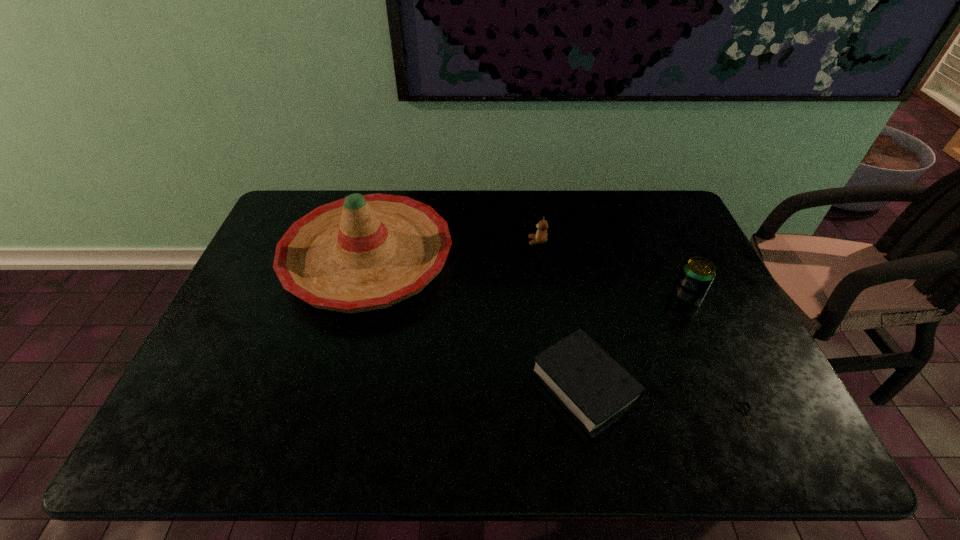
Where is `vacant space in between the Bible and the sombrero`? This screenshot has height=540, width=960. vacant space in between the Bible and the sombrero is located at coordinates (476, 322).

Identify the location of vacant space in between the leftmost object and the shortest object. (559, 340).

Identify the location of empty space that is in between the teddy bear and the shears. (643, 331).

The width and height of the screenshot is (960, 540). I want to click on free space between the third tallest object and the tallest object, so click(x=453, y=250).

The height and width of the screenshot is (540, 960). I want to click on free point between the shears and the fourth tallest object, so click(667, 403).

The image size is (960, 540). I want to click on vacant area that lies between the Bible and the fourth shortest object, so click(636, 342).

Identify the location of free space between the second tallest object and the sombrero. (527, 279).

Identify the location of vacant region between the shears and the teddy bear. This screenshot has height=540, width=960. (643, 331).

Point out which object is positioned as the fourth nearest to the third tallest object. Please provide its 2D coordinates. Your answer should be formatted as a tuple, i.e. [(x, y)], where the tuple contains the x and y coordinates of a point satisfying the conditions above.

[(745, 411)]

Select which object appears as the fourth closest to the leftmost object. Please provide its 2D coordinates. Your answer should be formatted as a tuple, i.e. [(x, y)], where the tuple contains the x and y coordinates of a point satisfying the conditions above.

[(745, 411)]